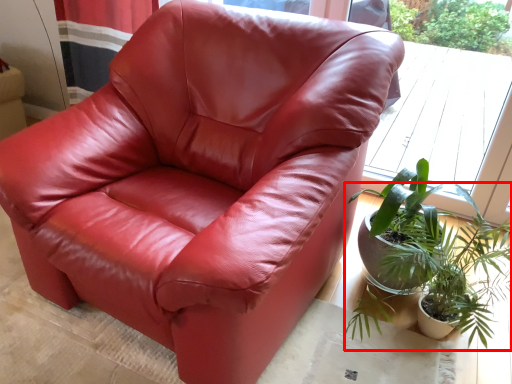
Question: Where is houseplant (annotated by the red box) located in relation to window in the image?

Choices:
 (A) left
 (B) right

Answer: (A)